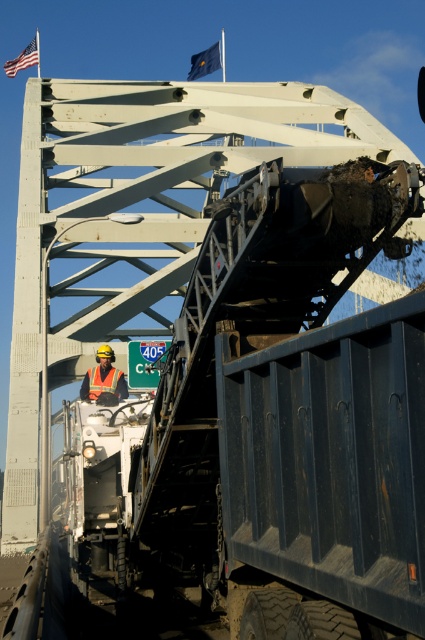
You are a construction worker standing at the edge of the bridge. You need to locate the orange reflective safety vest at center. According to the coordinates provided, where exactly would you find it?

The orange reflective safety vest at center is located at the 2D coordinates point [102,381].

You are a construction worker standing near the dump truck and see both the orange reflective vest at center and the orange reflective safety vest at center. Which one is closer to you?

The orange reflective vest at center is closer to you because it is in front of the orange reflective safety vest at center.

You are a construction worker wearing an orange reflective safety vest at center. You need to take a photo of the dump truck with a camera. The camera is located somewhere in the scene. Can you reach the camera from your current position without moving more than 50 feet? Please explain your reasoning.

The orange reflective safety vest at center and camera are 49.14 feet apart. Since 49.14 feet is less than 50 feet, you can reach the camera without moving more than 50 feet.